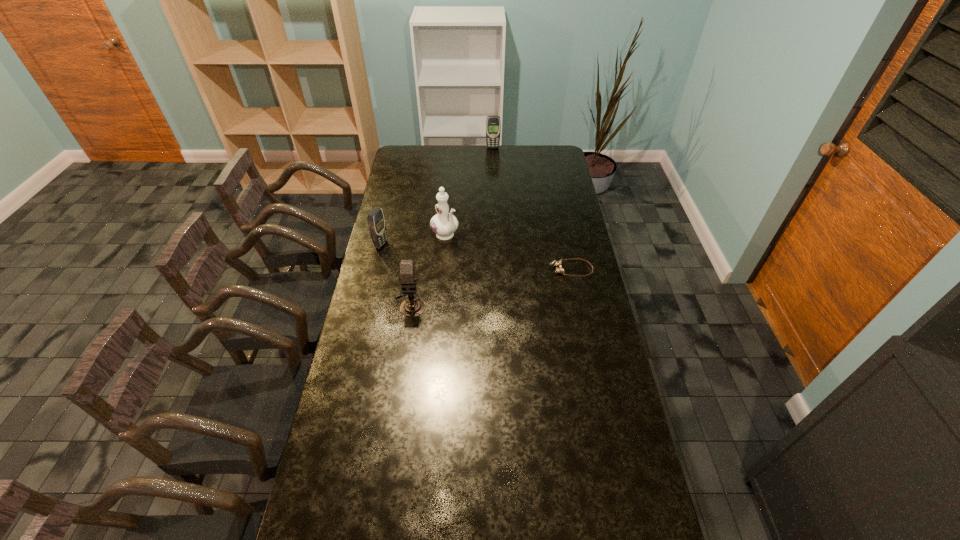
The width and height of the screenshot is (960, 540). Identify the location of vacant area that satisfies the following two spatial constraints: 1. on the front side of the left cellular telephone; 2. on the front lenses and sides of the fourth farthest object. (375, 269).

Image resolution: width=960 pixels, height=540 pixels. I want to click on free space that satisfies the following two spatial constraints: 1. on the front side of the goggles; 2. on the front lenses and sides of the leftmost object, so click(375, 269).

Locate an element on the screen. The width and height of the screenshot is (960, 540). free space in the image that satisfies the following two spatial constraints: 1. on the back side of the right cellular telephone; 2. on the left side of the left cellular telephone is located at coordinates (403, 147).

Identify the location of vacant space that satisfies the following two spatial constraints: 1. on the front side of the rightmost object; 2. on the front lenses and sides of the nearer cellular telephone. (375, 269).